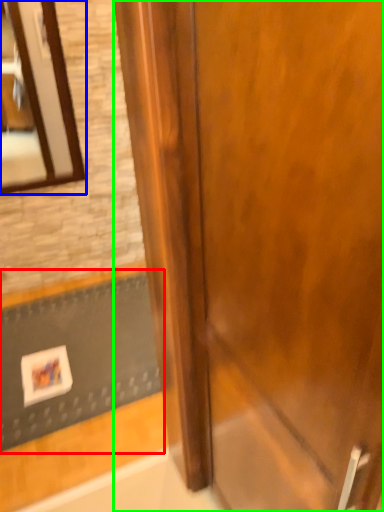
Question: Which object is the closest to the doormat (highlighted by a red box)? Choose among these: mirror (highlighted by a blue box) or door (highlighted by a green box).

Choices:
 (A) mirror
 (B) door

Answer: (A)